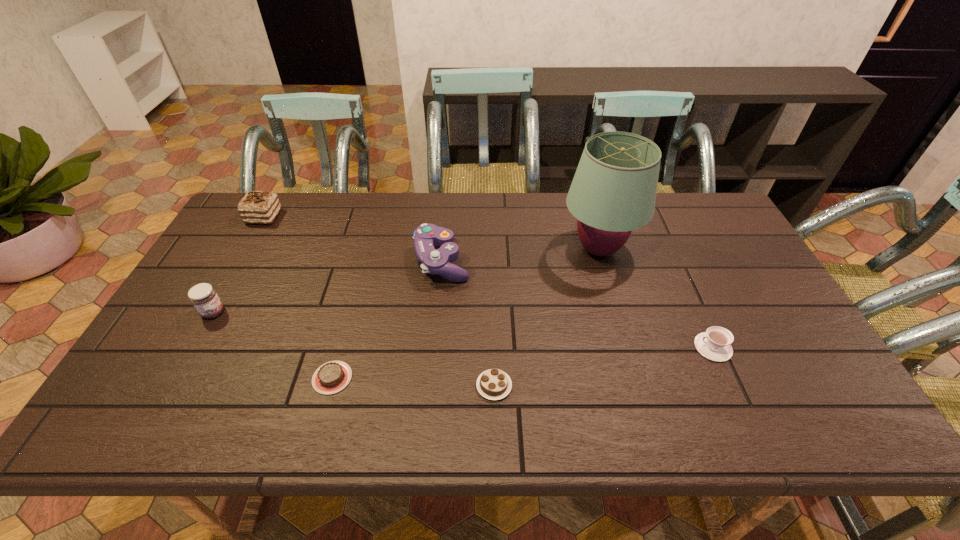
Image resolution: width=960 pixels, height=540 pixels. Identify the location of free region located 0.280m on the front of the sixth object from left to right. (630, 357).

Where is `vacant space located 0.290m on the front of the control`? Image resolution: width=960 pixels, height=540 pixels. vacant space located 0.290m on the front of the control is located at coordinates (431, 374).

Locate an element on the screen. This screenshot has height=540, width=960. vacant region located on the right of the farthest chocolate cake is located at coordinates (324, 217).

The width and height of the screenshot is (960, 540). I want to click on blank space located on the front label of the fourth farthest object, so click(x=354, y=313).

I want to click on vacant region located 0.230m on the handle side of the fifth tallest object, so click(x=603, y=347).

Image resolution: width=960 pixels, height=540 pixels. Find the location of `free space located on the handle side of the fifth tallest object`. free space located on the handle side of the fifth tallest object is located at coordinates (636, 347).

What are the coordinates of `vacant space located 0.170m on the handle side of the fifth tallest object` in the screenshot? It's located at 627,347.

Locate an element on the screen. The height and width of the screenshot is (540, 960). vacant space located on the right of the rightmost chocolate cake is located at coordinates (632, 386).

This screenshot has width=960, height=540. Identify the location of vacant space located 0.220m on the back of the third object from left to right. (354, 295).

Identify the location of lampshade that is positioned at the far edge. (613, 192).